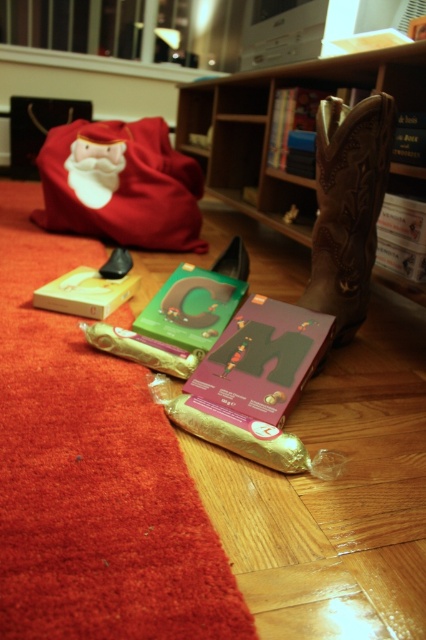
You are standing in the room and want to pick up the brown leather bookshelf at upper center and the brown leather cowboy boot at right. Which object will you need to move first to reach the other?

You need to move the brown leather bookshelf at upper center first because it is closer to you than the brown leather cowboy boot at right, so you must move it to access the boot which is behind it.

You are standing at the origin point in the room and want to pick up an item located at point (x=325, y=141). Is this point closer to you than the other item at point (x=58, y=296)?

Point (x=325, y=141) is in front of point (x=58, y=296), so it is closer to you. Therefore, the item at point (x=325, y=141) is closer than the other item at point (x=58, y=296).